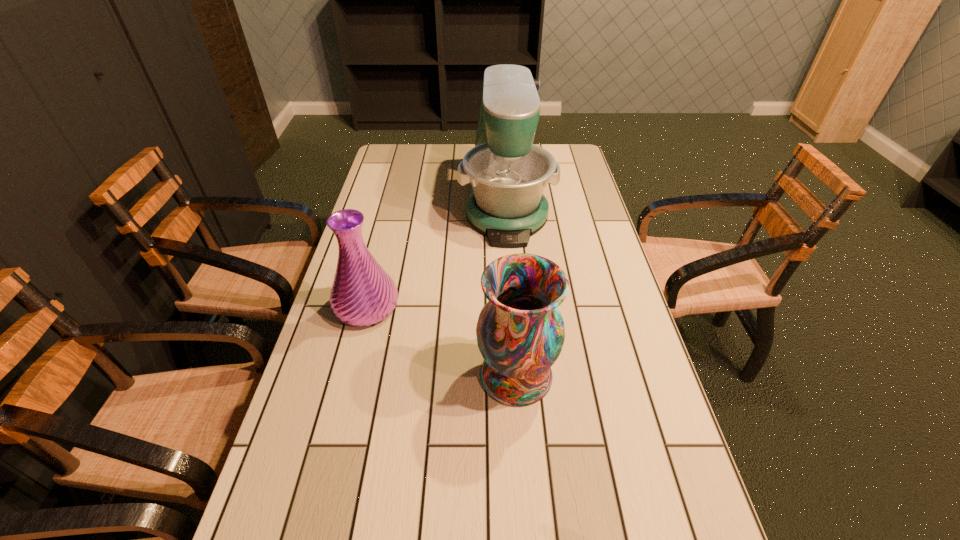
Locate an element on the screen. The width and height of the screenshot is (960, 540). object that is positioned at the left edge is located at coordinates (362, 294).

Locate an element on the screen. This screenshot has height=540, width=960. object present at the right edge is located at coordinates tap(507, 173).

At what (x,y) coordinates should I click in order to perform the action: click on object that is at the far right corner. Please return your answer as a coordinate pair (x, y). Looking at the image, I should click on (507, 173).

I want to click on vacant region at the far edge of the desktop, so click(x=445, y=167).

You are a GUI agent. You are given a task and a screenshot of the screen. Output one action in this format:
    pyautogui.click(x=<x>, y=<y>)
    Task: Click on the free space at the left edge of the desktop
    Image resolution: width=960 pixels, height=540 pixels.
    Given the screenshot: What is the action you would take?
    pyautogui.click(x=411, y=195)

At what (x,y) coordinates should I click in order to perform the action: click on free space at the right edge of the desktop. Please return your answer as a coordinate pair (x, y). Looking at the image, I should click on (577, 211).

In the image, there is a desktop. Where is `vacant space at the far left corner`? vacant space at the far left corner is located at coordinates (418, 168).

In the image, there is a desktop. Where is `vacant space at the far right corner`? The image size is (960, 540). vacant space at the far right corner is located at coordinates (571, 168).

The width and height of the screenshot is (960, 540). Identify the location of empty space that is in between the leftmost object and the right vase. (442, 341).

At what (x,y) coordinates should I click in order to perform the action: click on free point between the leftmost object and the right vase. Please return your answer as a coordinate pair (x, y). Looking at the image, I should click on (442, 341).